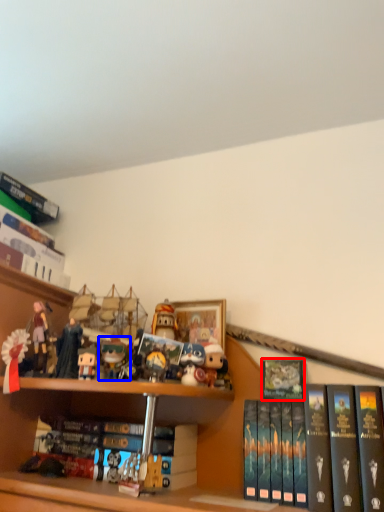
Question: Which object appears closest to the camera in this image, book (highlighted by a red box) or toy (highlighted by a blue box)?

Choices:
 (A) book
 (B) toy

Answer: (A)